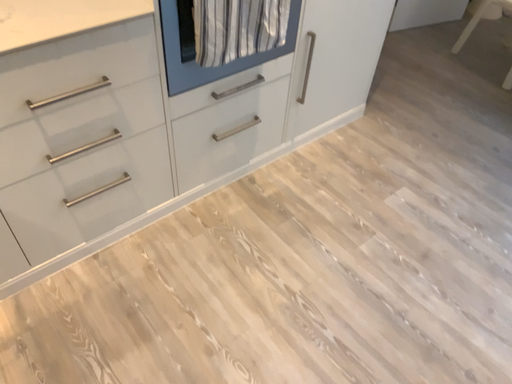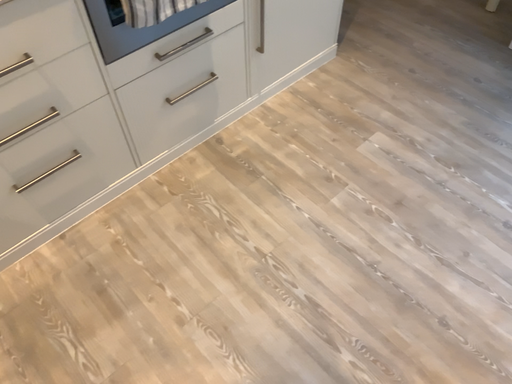
Question: Which way did the camera rotate in the video?

Choices:
 (A) rotated upward
 (B) rotated downward

Answer: (B)